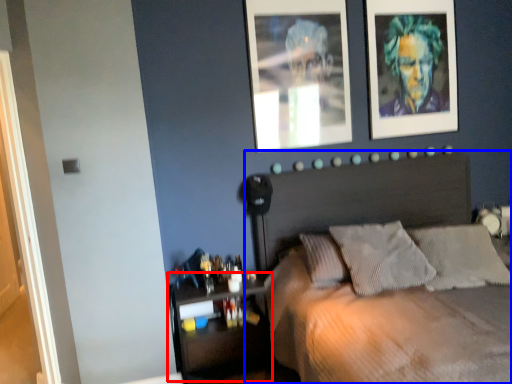
Question: Which of the following is the farthest to the observer, shelf (highlighted by a red box) or bed (highlighted by a blue box)?

Choices:
 (A) shelf
 (B) bed

Answer: (A)